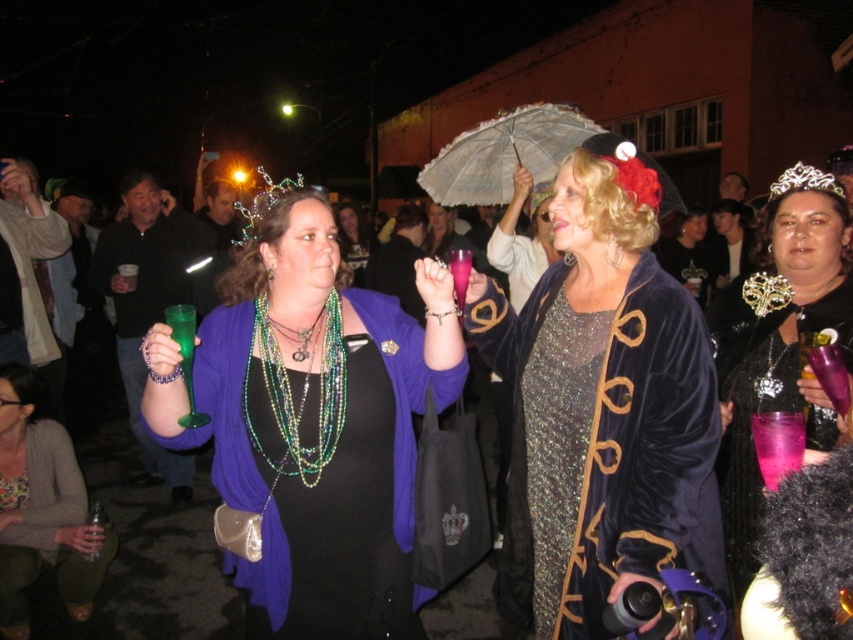
Question: Which point appears farthest from the camera in this image?

Choices:
 (A) (467, 147)
 (B) (363, 268)
 (C) (804, 216)

Answer: (B)

Question: Considering the real-world distances, which object is farthest from the white lace umbrella at center?

Choices:
 (A) shiny black dress at center
 (B) matte black dress at center
 (C) velvet dress at center

Answer: (B)

Question: Is matte purple sweater at center further to the viewer compared to gold metallic tiara at upper right?

Choices:
 (A) no
 (B) yes

Answer: (A)

Question: Among these points, which one is nearest to the camera?

Choices:
 (A) (722, 406)
 (B) (833, 192)
 (C) (67, 529)
 (D) (583, 232)

Answer: (D)

Question: Can you confirm if velvet dress at center is bigger than shiny black dress at center?

Choices:
 (A) no
 (B) yes

Answer: (A)

Question: Is matte black dress at center to the left of white lace umbrella at center from the viewer's perspective?

Choices:
 (A) no
 (B) yes

Answer: (B)